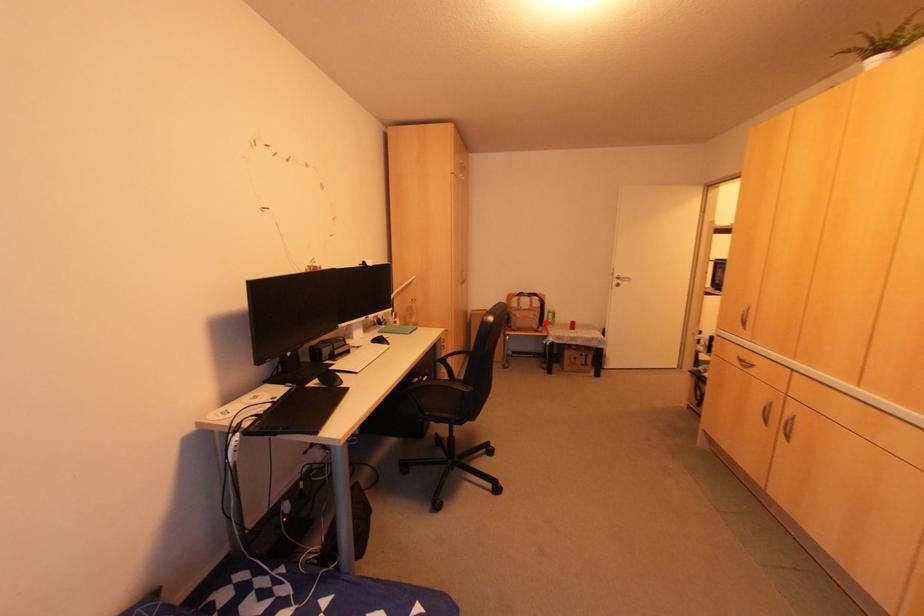
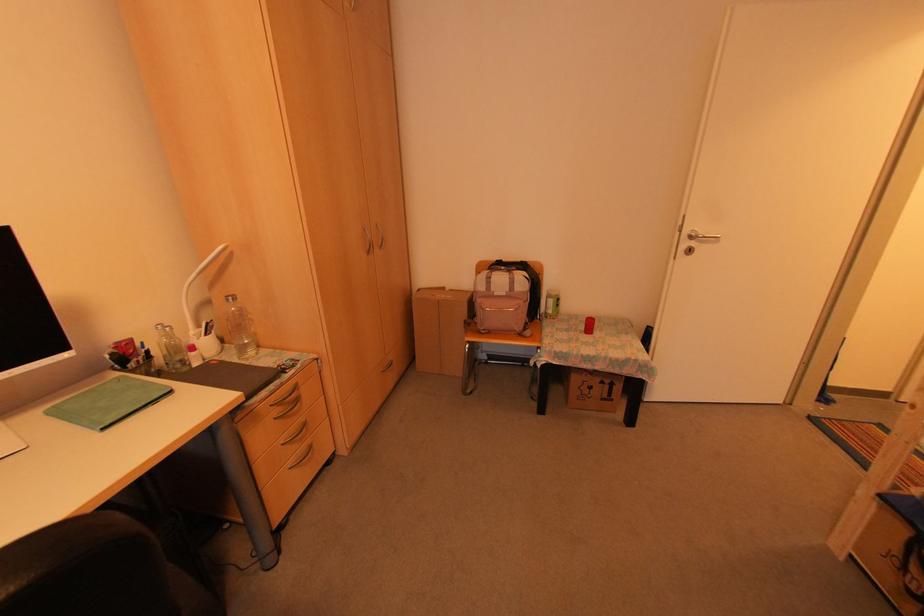
In the second image, find the point that corresponds to the highlighted location in the first image.

(543, 314)